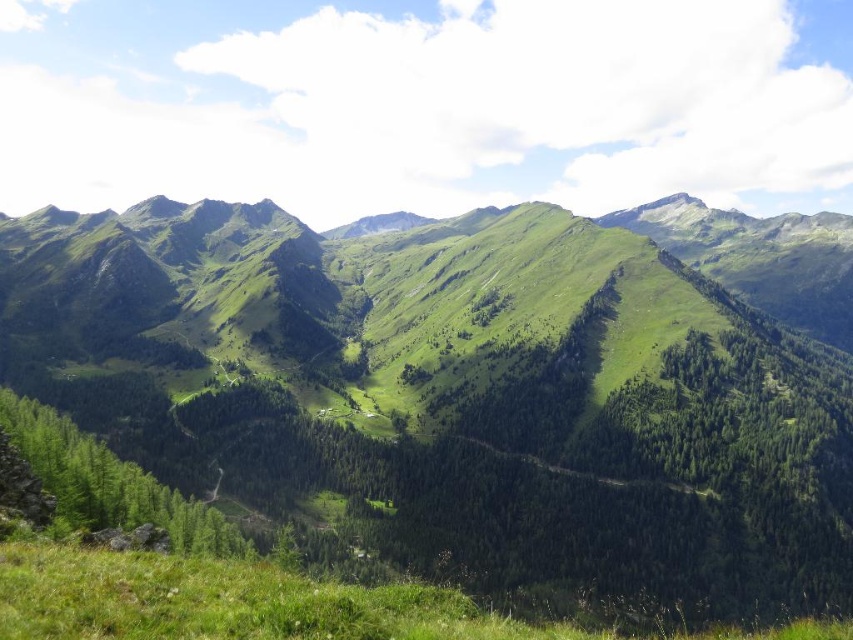
You are a hiker planning to traverse the area shown in the image. You need to move from the green grassy at lower center to the green grassy mountain at center. Considering their sizes, which area is more likely to have a steeper slope? Please explain your reasoning based on the scene description.

The green grassy mountain at center has a larger size compared to the green grassy at lower center. Since the mountain is larger and part of the rugged, steep peaks, it is more likely to have a steeper slope than the smaller, lower grassy area which is part of the gentle slope in the foreground.